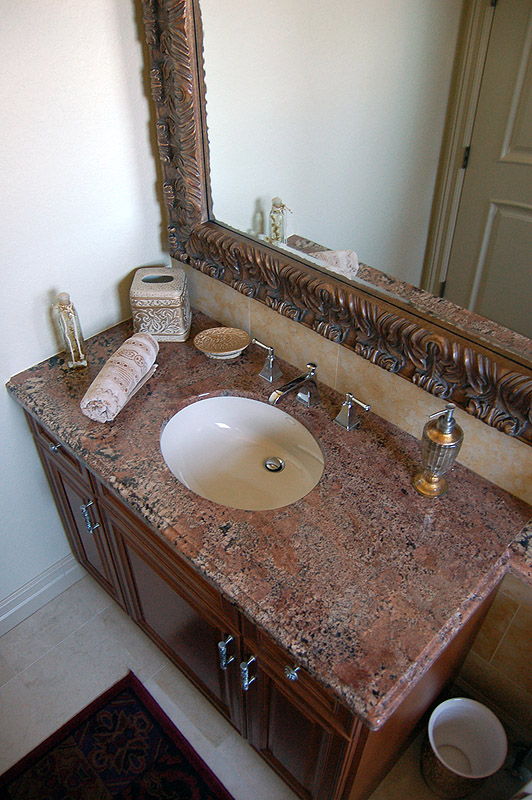
Locate an element on the screen. speckled soap dish is located at coordinates (222, 344).